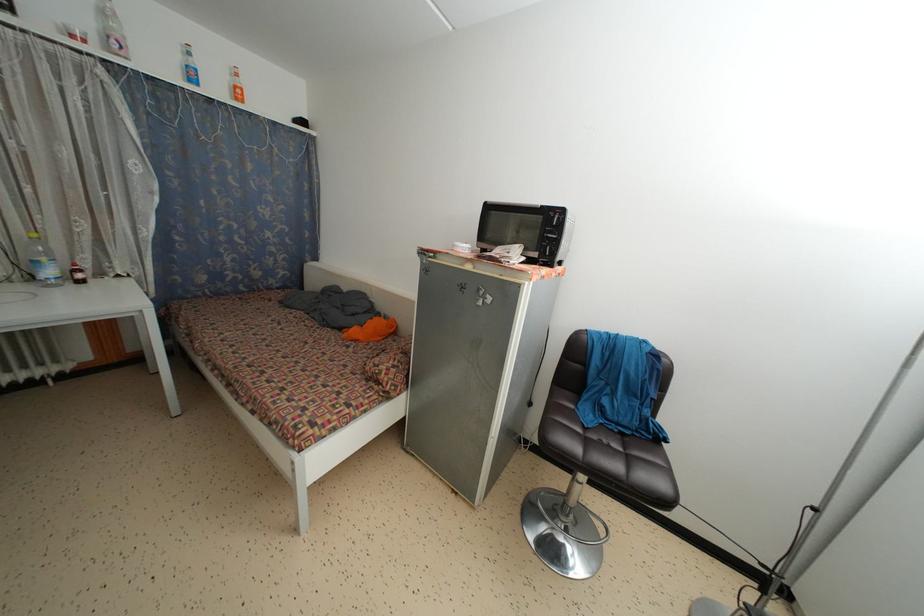
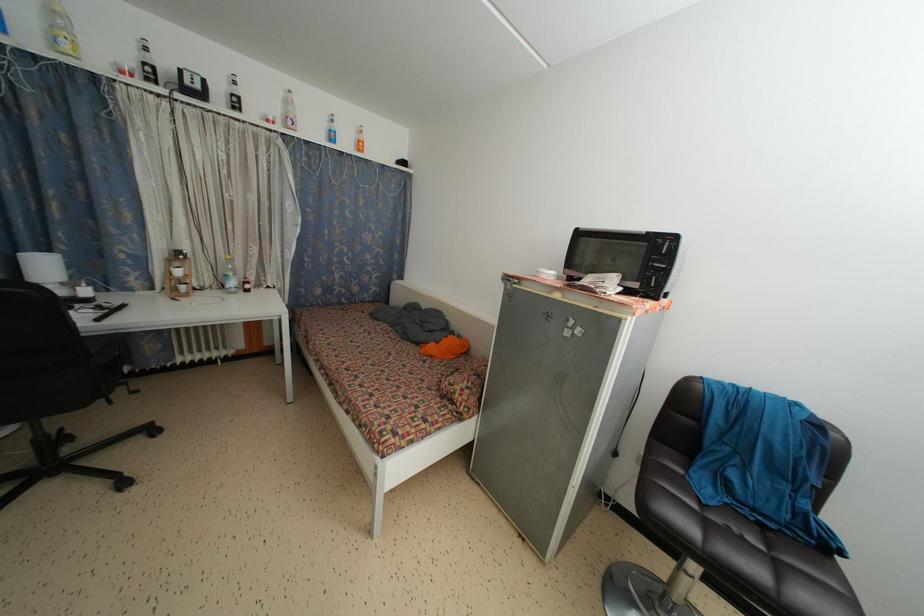
Where in the second image is the point corresponding to [55,278] from the first image?

(237, 289)